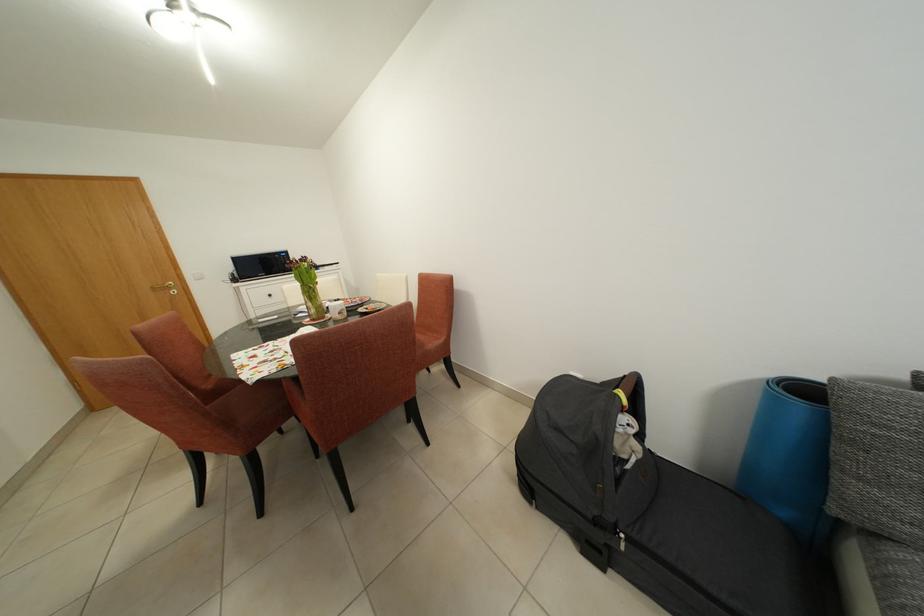
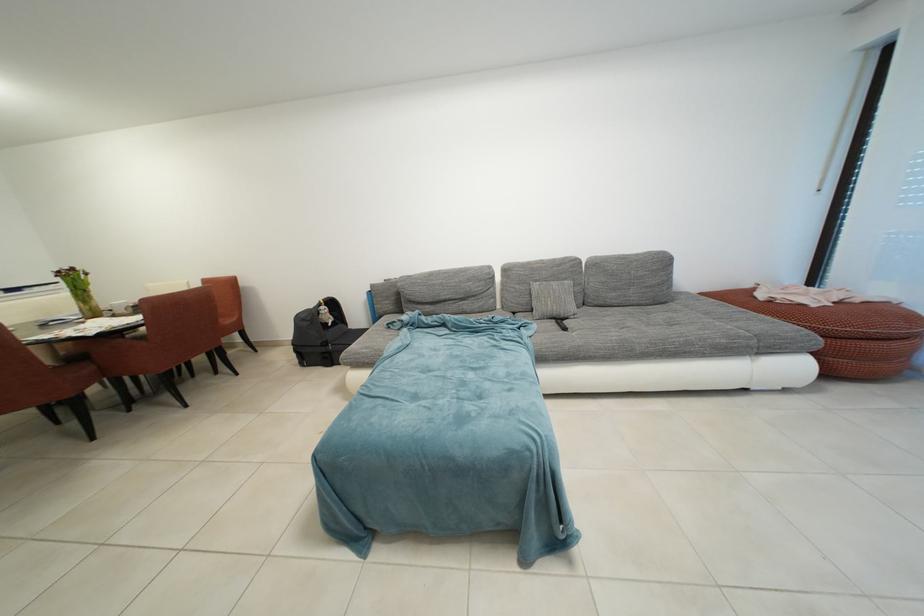
Find the pixel in the second image that matches [312,264] in the first image.

(81, 274)